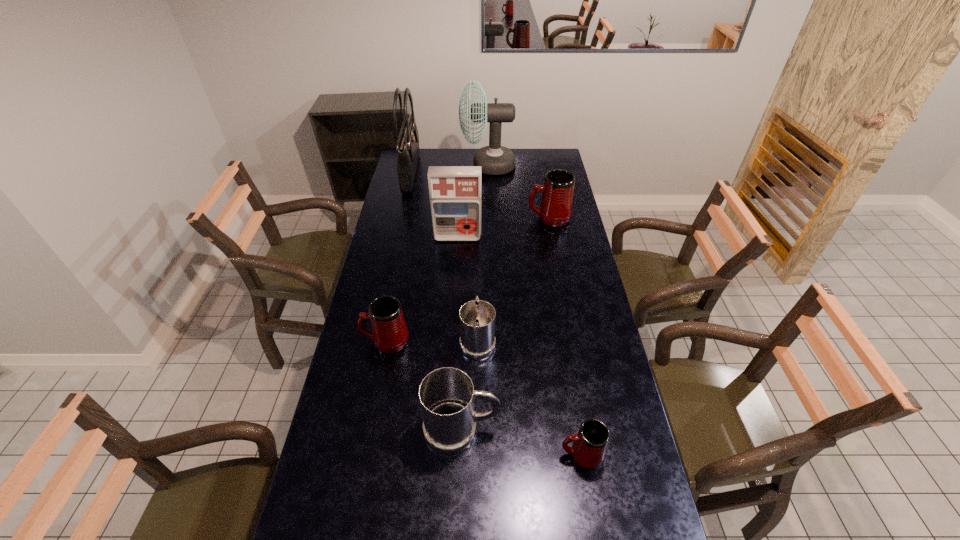
Where is `mug located in the left edge section of the desktop`? mug located in the left edge section of the desktop is located at coordinates [389, 332].

I want to click on object that is at the far left corner, so click(x=407, y=146).

You are a GUI agent. You are given a task and a screenshot of the screen. Output one action in this format:
    pyautogui.click(x=<x>, y=<y>)
    Task: Click on the free space at the far edge of the desktop
    Image resolution: width=960 pixels, height=540 pixels.
    Given the screenshot: What is the action you would take?
    pyautogui.click(x=455, y=152)

What are the coordinates of `vacant space at the left edge of the desktop` in the screenshot? It's located at (371, 285).

The image size is (960, 540). I want to click on blank space at the right edge of the desktop, so click(x=564, y=264).

Where is `free space that is in between the second farthest red mug and the fan`? free space that is in between the second farthest red mug and the fan is located at coordinates (437, 253).

Find the location of a particular element. This screenshot has height=540, width=960. free space between the second farthest red mug and the sixth shortest object is located at coordinates (421, 289).

I want to click on free point between the fourth farthest object and the farther gray mug, so click(468, 288).

I want to click on vacant space that is in between the third tallest object and the leftmost red mug, so click(x=421, y=289).

You are a GUI agent. You are given a task and a screenshot of the screen. Output one action in this format:
    pyautogui.click(x=<x>, y=<y>)
    Task: Click on the empty space that is in between the farthest red mug and the smaller gray mug
    
    Given the screenshot: What is the action you would take?
    click(x=514, y=279)